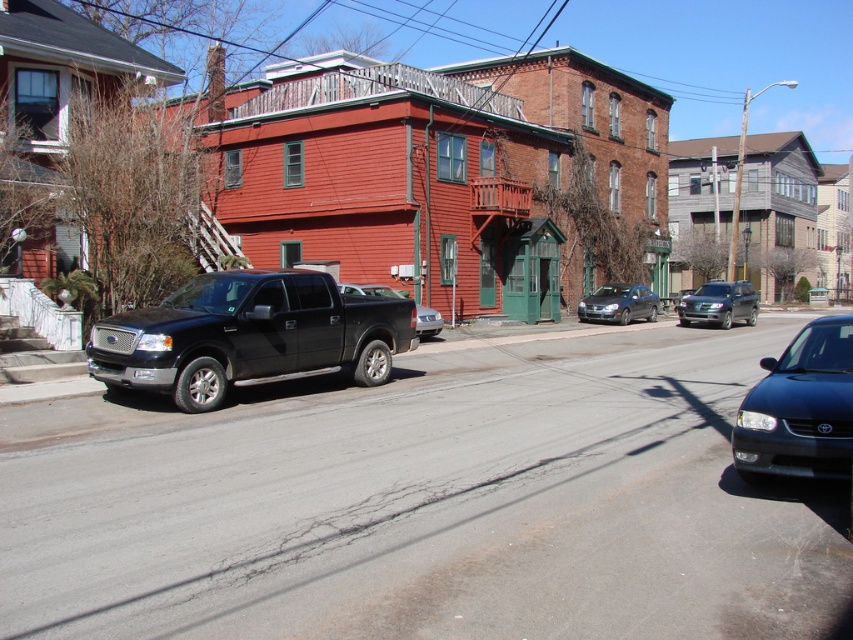
You are a delivery person standing at the camera position. You need to deliver a package to the address located at the red building with green trim on the left. The package requires a vehicle to be parked within 6 meters to unload safely. Can you safely unload your package from the satin black sedan at lower right?

The satin black sedan at lower right is 5.85 meters away from the camera, which is within the 6 meter safety distance required for unloading. Therefore, you can safely unload your package from the satin black sedan at lower right.

You are standing on the street looking at the red building with green trim. There are two points marked on the building wall. One is at coordinate point (180, 374) and the other is at point (834, 364). Which point is closer to you?

Point (180, 374) is closer to you because it is further to the viewer than point (834, 364) according to the description.

You are a delivery person trying to park your 12 feet long van between the satin silver sedan at center and the metallic silver sedan at center. Can you fit your van in the space between them without overlapping either vehicle?

The satin silver sedan at center and metallic silver sedan at center are 36.04 feet apart from each other. Since your van is 12 feet long, there is sufficient space between the two sedans to park your van without overlapping either vehicle.